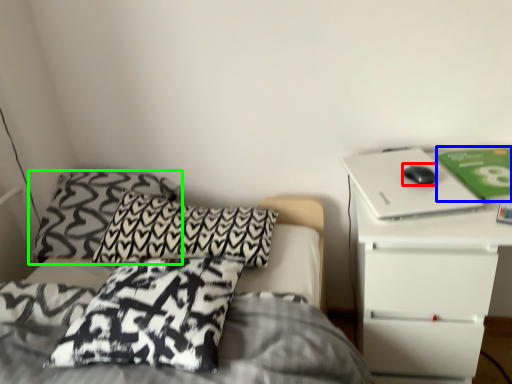
Question: Estimate the real-world distances between objects in this image. Which object is closer to mouse (highlighted by a red box), paperback book (highlighted by a blue box) or pillow (highlighted by a green box)?

Choices:
 (A) paperback book
 (B) pillow

Answer: (A)